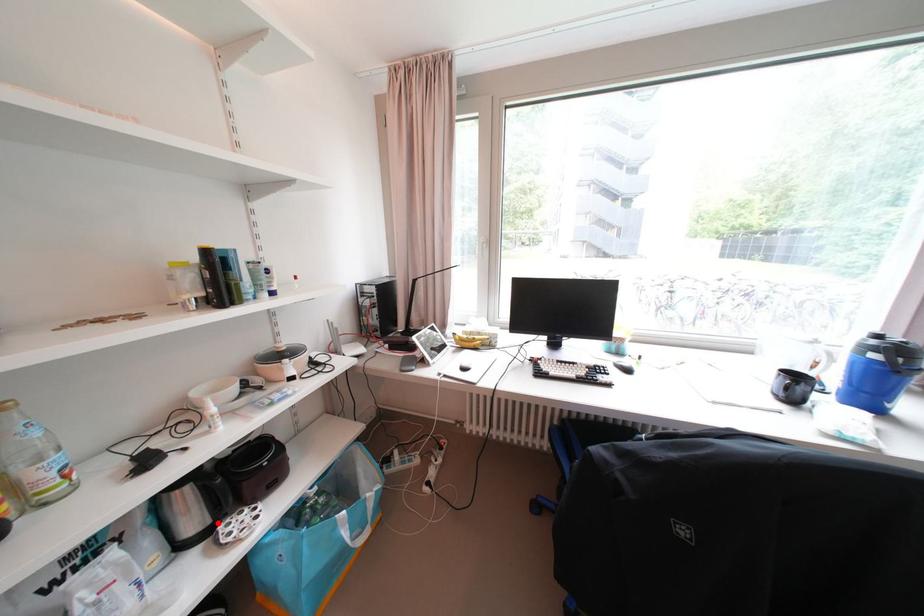
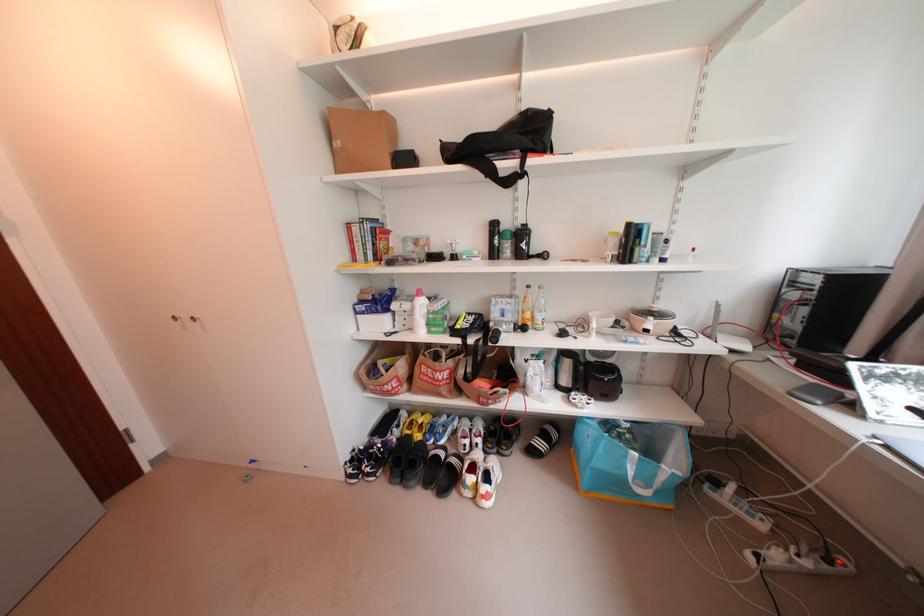
The point at the highlighted location is marked in the first image. Where is the corresponding point in the second image?

(578, 387)